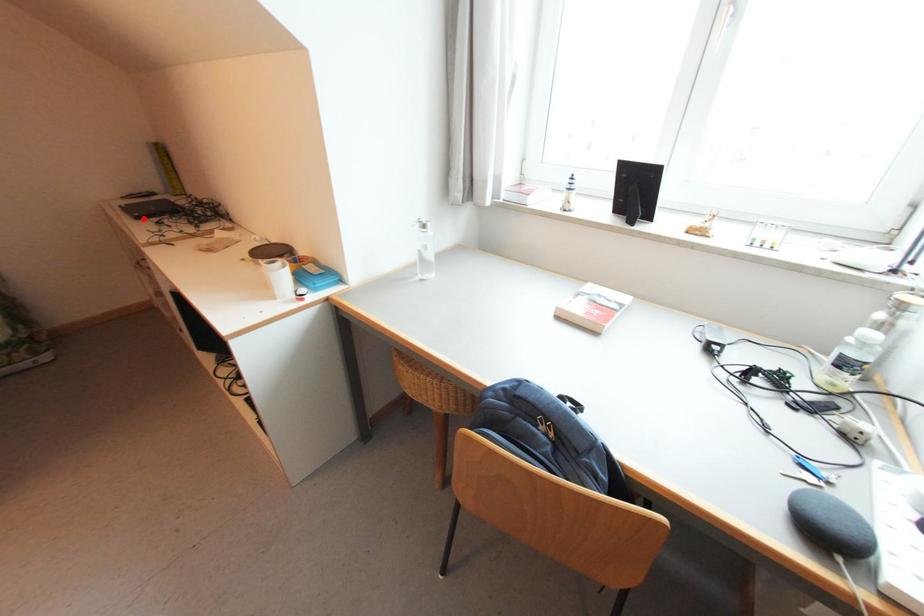
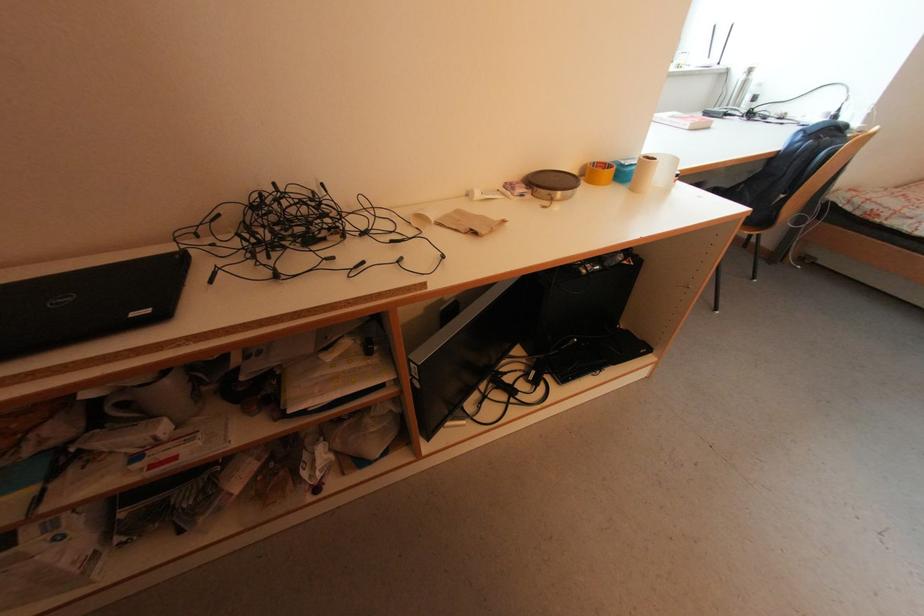
In the second image, find the point that corresponds to the highlighted location in the first image.

(168, 317)